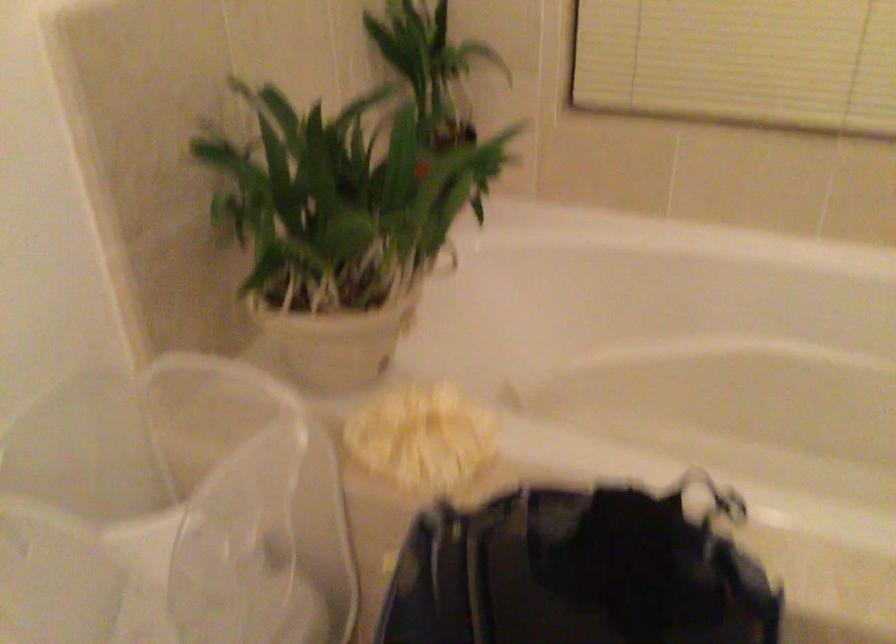
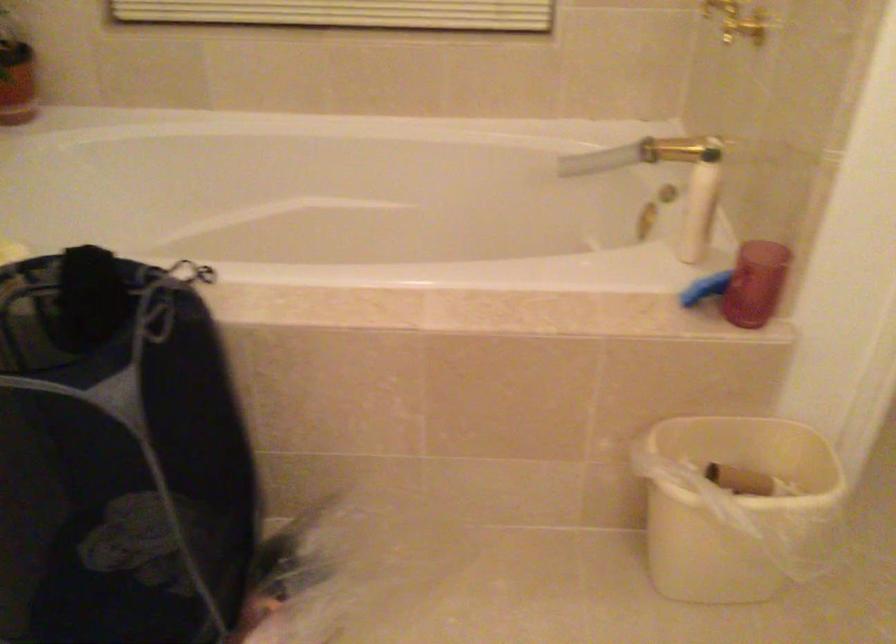
Question: The camera is either moving clockwise (left) or counter-clockwise (right) around the object. The first image is from the beginning of the video and the second image is from the end. Is the camera moving left or right when shooting the video?

Choices:
 (A) Left
 (B) Right

Answer: (A)